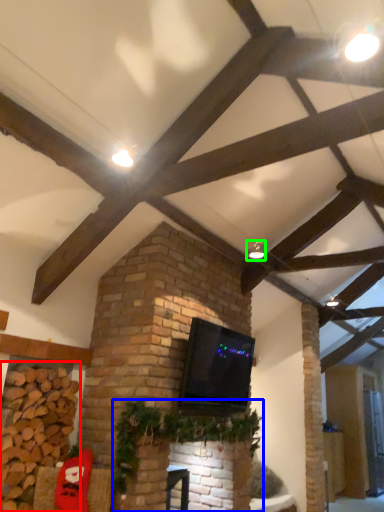
Question: Estimate the real-world distances between objects in this image. Which object is farther from brickwork (highlighted by a red box), christmas decoration (highlighted by a blue box) or light fixture (highlighted by a green box)?

Choices:
 (A) christmas decoration
 (B) light fixture

Answer: (B)